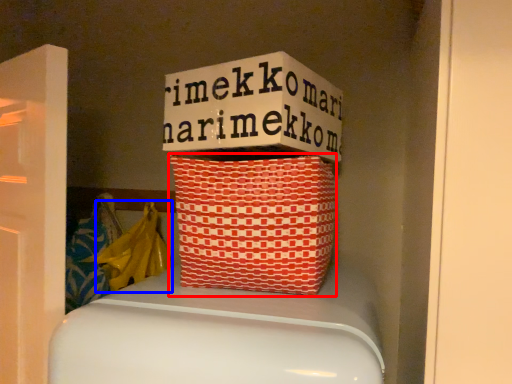
Question: Which object is closer to the camera taking this photo, basket (highlighted by a red box) or material (highlighted by a blue box)?

Choices:
 (A) basket
 (B) material

Answer: (A)